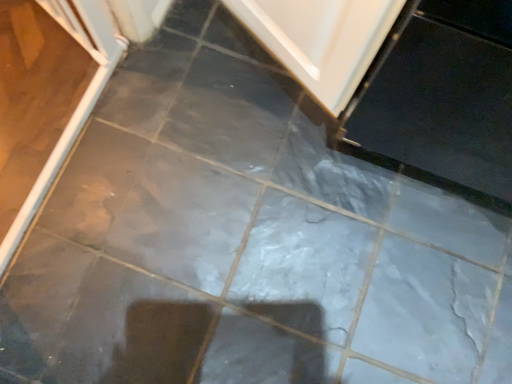
Question: Is the position of white glossy screen door at left less distant than that of white glossy door at upper center?

Choices:
 (A) yes
 (B) no

Answer: (A)

Question: Is white glossy screen door at left looking in the opposite direction of white glossy door at upper center?

Choices:
 (A) no
 (B) yes

Answer: (A)

Question: Is white glossy screen door at left beside white glossy door at upper center?

Choices:
 (A) yes
 (B) no

Answer: (B)

Question: Does white glossy screen door at left have a lesser height compared to white glossy door at upper center?

Choices:
 (A) yes
 (B) no

Answer: (A)

Question: From a real-world perspective, does white glossy screen door at left stand above white glossy door at upper center?

Choices:
 (A) yes
 (B) no

Answer: (B)

Question: Considering the relative positions of white glossy screen door at left and white glossy door at upper center in the image provided, is white glossy screen door at left behind white glossy door at upper center?

Choices:
 (A) no
 (B) yes

Answer: (A)

Question: Is white glossy door at upper center beside white glossy screen door at left?

Choices:
 (A) no
 (B) yes

Answer: (A)

Question: Would you consider white glossy door at upper center to be distant from white glossy screen door at left?

Choices:
 (A) no
 (B) yes

Answer: (A)

Question: Is the depth of white glossy door at upper center greater than that of white glossy screen door at left?

Choices:
 (A) yes
 (B) no

Answer: (A)

Question: Does white glossy door at upper center have a lesser height compared to white glossy screen door at left?

Choices:
 (A) yes
 (B) no

Answer: (B)

Question: From the image's perspective, is white glossy door at upper center above white glossy screen door at left?

Choices:
 (A) no
 (B) yes

Answer: (B)

Question: Is white glossy door at upper center oriented away from white glossy screen door at left?

Choices:
 (A) yes
 (B) no

Answer: (B)

Question: Is white glossy door at upper center inside the boundaries of white glossy screen door at left, or outside?

Choices:
 (A) outside
 (B) inside

Answer: (A)